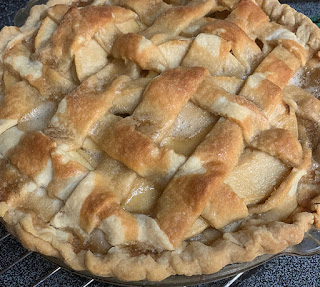
Find the location of `tray`. tray is located at coordinates (309, 249).